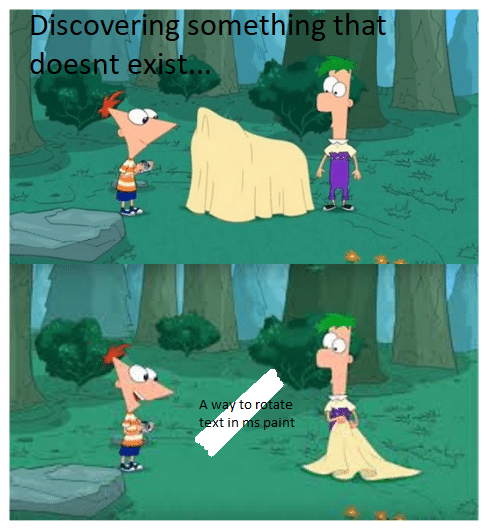
Find the location of a particular element. This screenshot has height=532, width=500. item hidden under blanket is located at coordinates (238, 164).